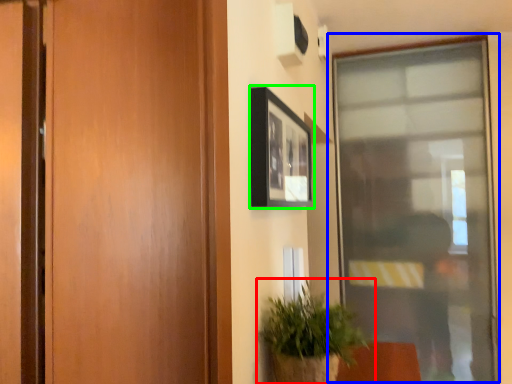
Question: Estimate the real-world distances between objects in this image. Which object is farther from houseplant (highlighted by a red box), window (highlighted by a blue box) or picture frame (highlighted by a green box)?

Choices:
 (A) window
 (B) picture frame

Answer: (A)